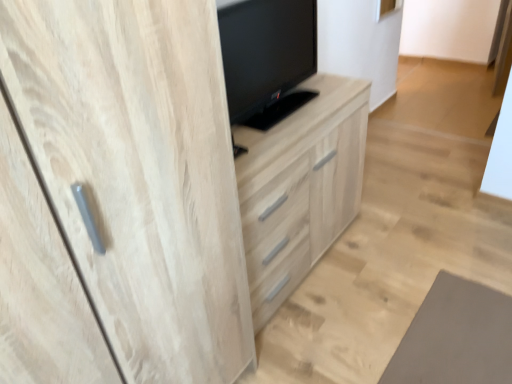
Question: Is light wood cabinet at center shorter than black glossy tv at center?

Choices:
 (A) yes
 (B) no

Answer: (B)

Question: From a real-world perspective, is light wood cabinet at center under black glossy tv at center?

Choices:
 (A) yes
 (B) no

Answer: (A)

Question: Can you confirm if light wood cabinet at center is taller than black glossy tv at center?

Choices:
 (A) no
 (B) yes

Answer: (B)

Question: From a real-world perspective, is light wood cabinet at center on black glossy tv at center?

Choices:
 (A) no
 (B) yes

Answer: (A)

Question: From the image's perspective, does light wood cabinet at center appear lower than black glossy tv at center?

Choices:
 (A) yes
 (B) no

Answer: (A)

Question: Does light wood cabinet at center have a larger size compared to black glossy tv at center?

Choices:
 (A) no
 (B) yes

Answer: (B)

Question: Does black glossy tv at center have a greater width compared to light wood cabinet at center?

Choices:
 (A) no
 (B) yes

Answer: (A)

Question: Is black glossy tv at center positioned beyond the bounds of light wood cabinet at center?

Choices:
 (A) no
 (B) yes

Answer: (B)

Question: Is black glossy tv at center not close to light wood cabinet at center?

Choices:
 (A) no
 (B) yes

Answer: (A)

Question: Can you confirm if black glossy tv at center is positioned to the right of light wood cabinet at center?

Choices:
 (A) yes
 (B) no

Answer: (B)

Question: Considering the relative sizes of black glossy tv at center and light wood cabinet at center in the image provided, is black glossy tv at center smaller than light wood cabinet at center?

Choices:
 (A) yes
 (B) no

Answer: (A)

Question: From the image's perspective, is black glossy tv at center beneath light wood cabinet at center?

Choices:
 (A) no
 (B) yes

Answer: (A)

Question: From their relative heights in the image, would you say black glossy tv at center is taller or shorter than light wood cabinet at center?

Choices:
 (A) tall
 (B) short

Answer: (B)